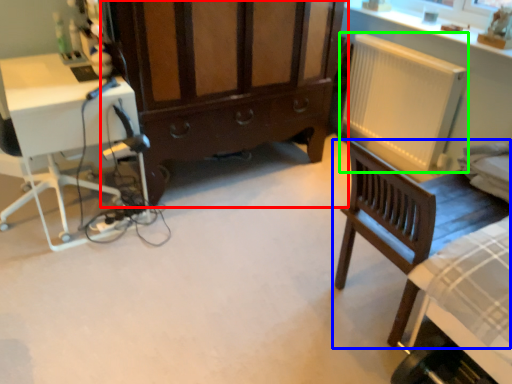
Question: Which is nearer to the cabinetry (highlighted by a red box)? chair (highlighted by a blue box) or radiator (highlighted by a green box).

Choices:
 (A) chair
 (B) radiator

Answer: (B)